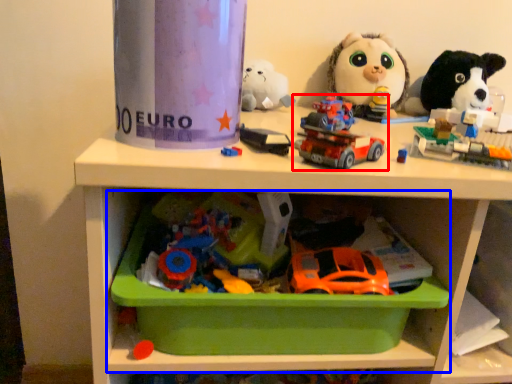
Question: Among these objects, which one is nearest to the camera, toy (highlighted by a red box) or shelf (highlighted by a blue box)?

Choices:
 (A) toy
 (B) shelf

Answer: (A)